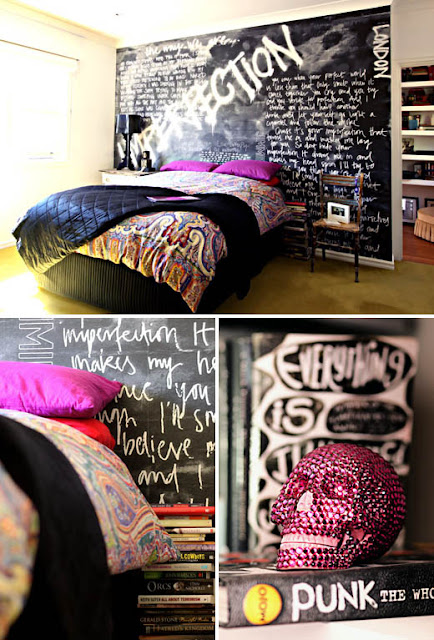
Where is `pink pillows`? pink pillows is located at coordinates (41, 385), (252, 164), (186, 164).